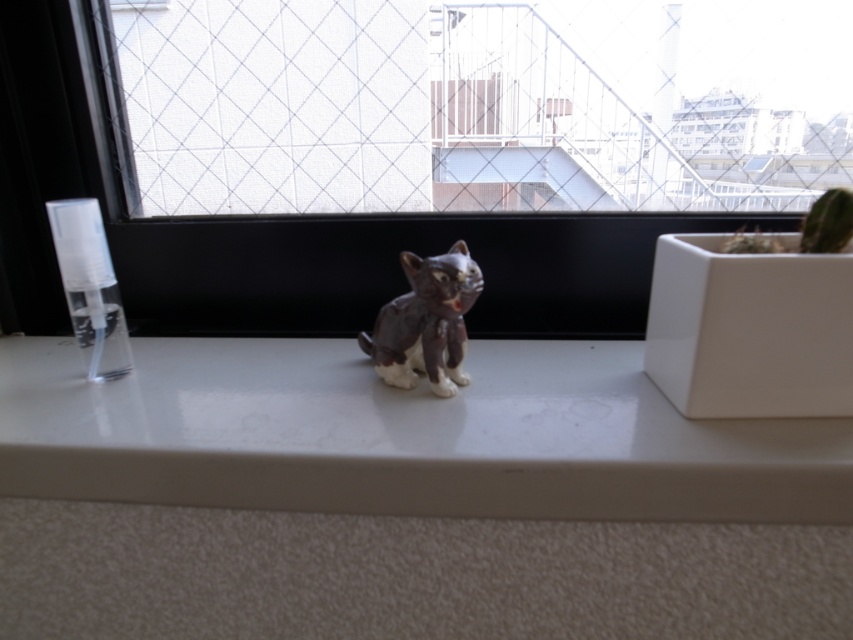
What is the 2D coordinate of the transparent mesh at center?

The transparent mesh at center is located at the 2D coordinate point of (457,109).

You are a delivery robot that needs to place a small package between the transparent mesh at center and the matte brown cat at center on the windowsill. The package is 1 meter long. Can you fit the package between them without moving either object?

The transparent mesh at center is 1.32 meters away from the matte brown cat at center. Since the package is 1 meter long, which is shorter than the distance between them, the robot can fit the package between them without moving either object.